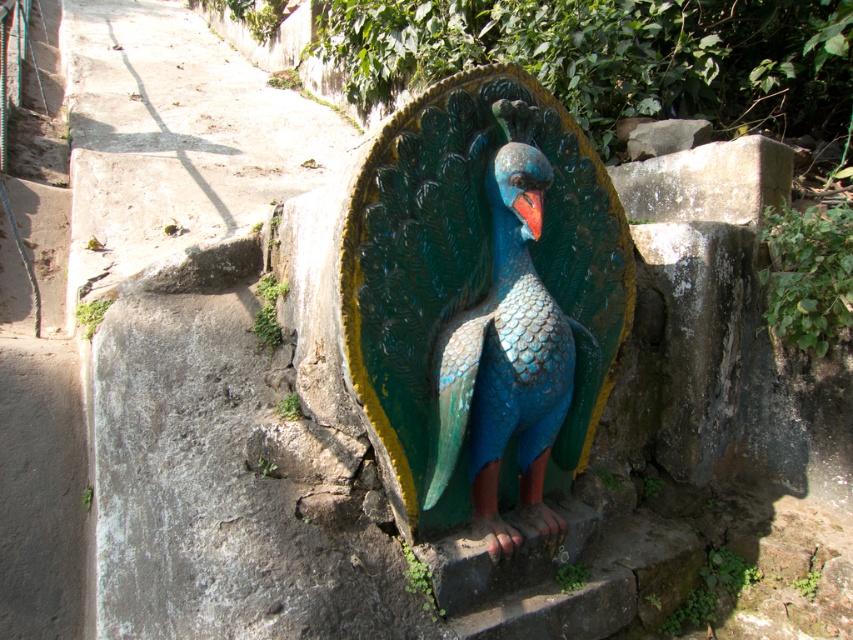
You are an artist planning to paint a miniature version of the scene. You need to ensure the shiny painted peacock at center and the shiny red beak at center are proportionally accurate. Which object should be larger in your painting?

The shiny painted peacock at center should be larger than the shiny red beak at center in the painting since it is bigger in the original scene.

You are a birdwatcher observing the shiny painted peacock at center and the shiny red beak at center. Which of these two objects is taller?

The shiny painted peacock at center is much taller than the shiny red beak at center.

You are an artist planning to sketch the peacock statue. You need to ensure the proportions are accurate. Which object is wider between the shiny painted peacock at center and the shiny red beak at center?

The shiny painted peacock at center is wider than the shiny red beak at center.